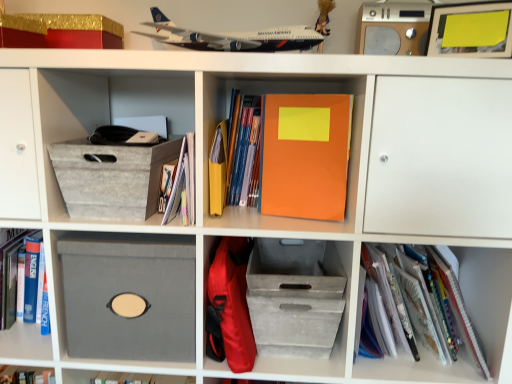
Question: Is white plastic airplane at upper center inside or outside of matte blue book at center, the second book when ordered from left to right?

Choices:
 (A) outside
 (B) inside

Answer: (A)

Question: In the image, is white plastic airplane at upper center on the left side or the right side of matte blue book at center, the second book when ordered from left to right?

Choices:
 (A) left
 (B) right

Answer: (A)

Question: Estimate the real-world distances between objects in this image. Which object is farther from the matte blue book at center, which is counted as the second book, starting from the right?

Choices:
 (A) matte gray storage bin at center
 (B) orange matte notebook at center, the 1th paperback book when ordered from right to left
 (C) white plastic airplane at upper center
 (D) gray fabric box at lower left, acting as the 2th cardboard box starting from the top
 (E) matte yellow paper at center, the 2th paperback book positioned from the right

Answer: (A)

Question: Estimate the real-world distances between objects in this image. Which object is closer to the white plastic airplane at upper center?

Choices:
 (A) matte yellow paper at center, the 2th paperback book positioned from the right
 (B) matte blue book at center, which is counted as the second book, starting from the right
 (C) orange matte notebook at center, which ranks as the second paperback book in left-to-right order
 (D) silver metallic speaker at upper right
 (E) gold/red cardboard box at upper left

Answer: (C)